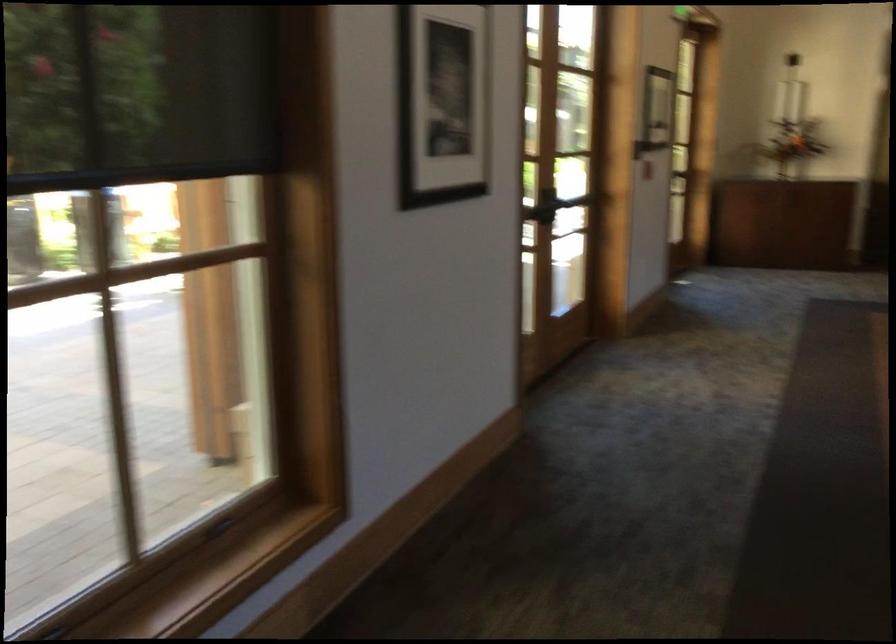
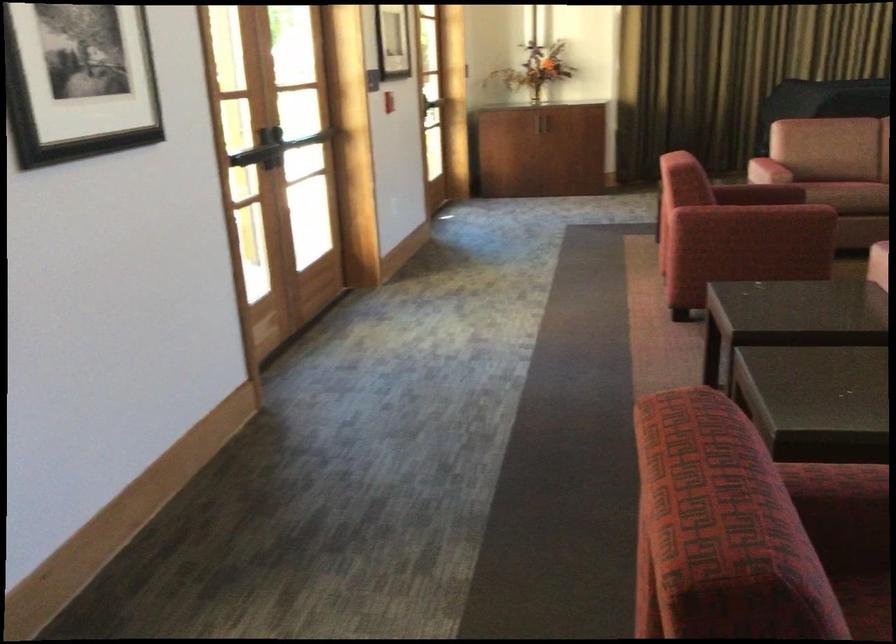
In a continuous first-person perspective shot, in which direction is the camera moving?

The cameraman moved toward right, forward.